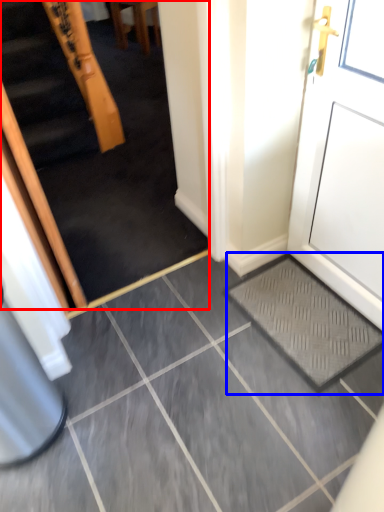
Question: Which object is closer to the camera taking this photo, escalator (highlighted by a red box) or doormat (highlighted by a blue box)?

Choices:
 (A) escalator
 (B) doormat

Answer: (A)